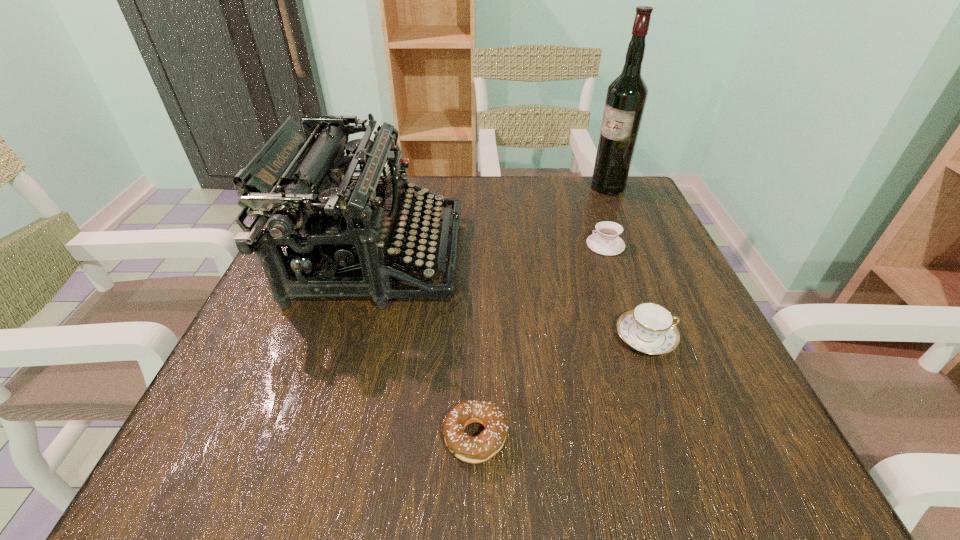
Where is `vacant space that's between the second tallest object and the farther teacup`? vacant space that's between the second tallest object and the farther teacup is located at coordinates (492, 251).

This screenshot has width=960, height=540. Identify the location of unoccupied position between the tallest object and the typewriter. (492, 222).

Find the location of a particular element. The height and width of the screenshot is (540, 960). vacant space that's between the farthest object and the third tallest object is located at coordinates (627, 262).

The image size is (960, 540). I want to click on free area in between the farther teacup and the tallest object, so click(607, 216).

The image size is (960, 540). Identify the location of empty location between the doughnut and the shorter teacup. (540, 341).

Find the location of a particular element. Image resolution: width=960 pixels, height=540 pixels. empty location between the typewriter and the wine bottle is located at coordinates (492, 222).

Locate an element on the screen. The image size is (960, 540). free space that is in between the fourth shortest object and the tallest object is located at coordinates (492, 222).

Where is `vacant space that's between the nearer teacup and the farther teacup`? The image size is (960, 540). vacant space that's between the nearer teacup and the farther teacup is located at coordinates (626, 291).

Identify which object is the third closest to the typewriter. Please provide its 2D coordinates. Your answer should be formatted as a tuple, i.e. [(x, y)], where the tuple contains the x and y coordinates of a point satisfying the conditions above.

[(649, 328)]

Locate an element on the screen. The image size is (960, 540). object that is the nearest to the nearest object is located at coordinates (300, 180).